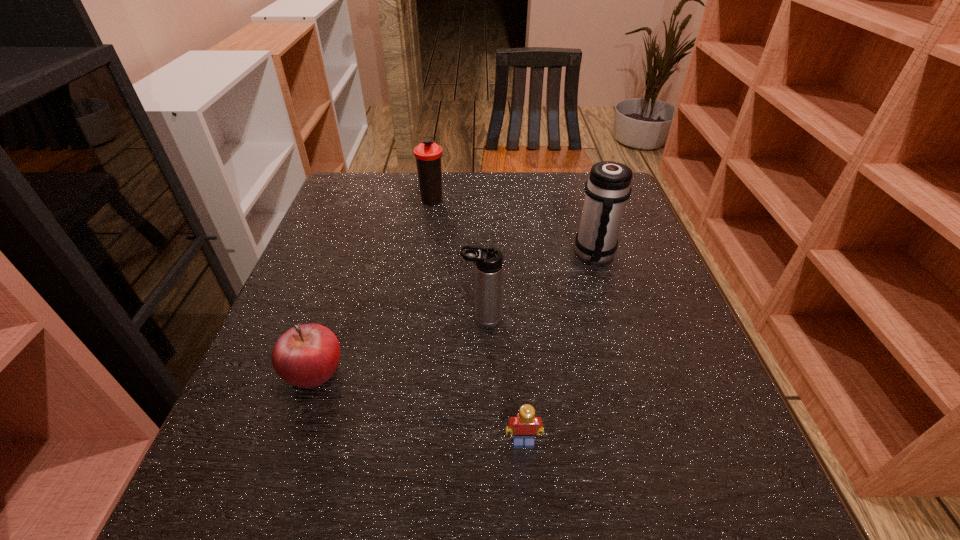
You are a GUI agent. You are given a task and a screenshot of the screen. Output one action in this format:
    pyautogui.click(x=<x>, y=<y>)
    Task: Click on the tallest object
    
    Given the screenshot: What is the action you would take?
    pyautogui.click(x=608, y=187)

Where is `the tallest thermos bottle`? the tallest thermos bottle is located at coordinates (608, 187).

Find the location of a particular element. Image resolution: width=960 pixels, height=540 pixels. the farthest object is located at coordinates [428, 154].

In order to click on the leftmost thermos bottle in this screenshot , I will do `click(428, 154)`.

Image resolution: width=960 pixels, height=540 pixels. I want to click on the third nearest object, so click(489, 260).

Where is `the second thermos bottle from right to left`? The width and height of the screenshot is (960, 540). the second thermos bottle from right to left is located at coordinates (489, 260).

You are a GUI agent. You are given a task and a screenshot of the screen. Output one action in this format:
    pyautogui.click(x=<x>, y=<y>)
    Task: Click on the second nearest object
    The height and width of the screenshot is (540, 960).
    Given the screenshot: What is the action you would take?
    pyautogui.click(x=306, y=356)

Find the location of a particular element. Image resolution: width=960 pixels, height=540 pixels. the leftmost object is located at coordinates (306, 356).

Where is `Lego`? This screenshot has height=540, width=960. Lego is located at coordinates (524, 424).

At what (x,y) coordinates should I click in order to perform the action: click on vacant space located 0.120m on the side with the handle of the rightmost object. Please return your answer as a coordinate pair (x, y). The height and width of the screenshot is (540, 960). Looking at the image, I should click on (612, 310).